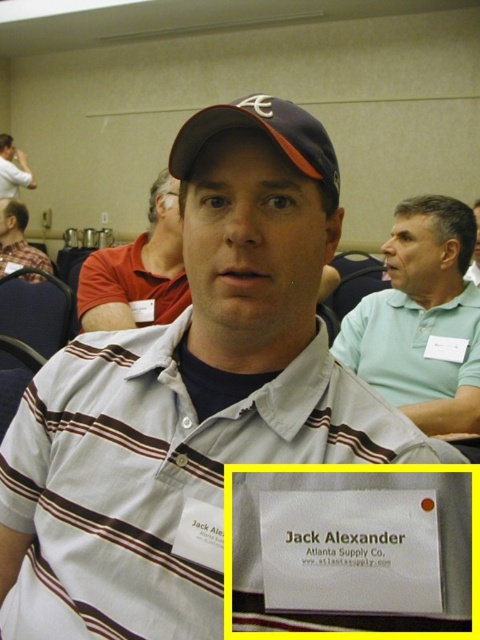
Looking at this image, you are standing in the conference room and want to reach the point marked at coordinates point (x=81, y=294). If your walking speed is 1.2 meters per second, how long will it take you to reach that point?

The distance between you and point (x=81, y=294) is 1.67 meters. At a speed of 1.2 meters per second, it will take approximately 1.39 seconds to reach the point.